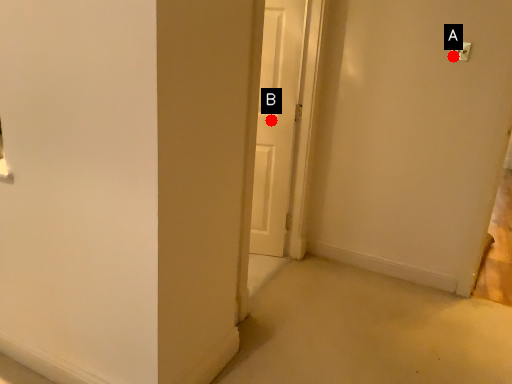
Question: Two points are circled on the image, labeled by A and B beside each circle. Which point is closer to the camera taking this photo?

Choices:
 (A) A is closer
 (B) B is closer

Answer: (A)